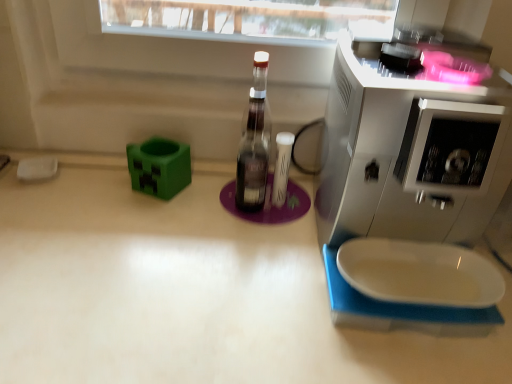
Identify the location of free space above white glossy coffee machine at upper right (from a real-world perspective). The height and width of the screenshot is (384, 512). (432, 94).